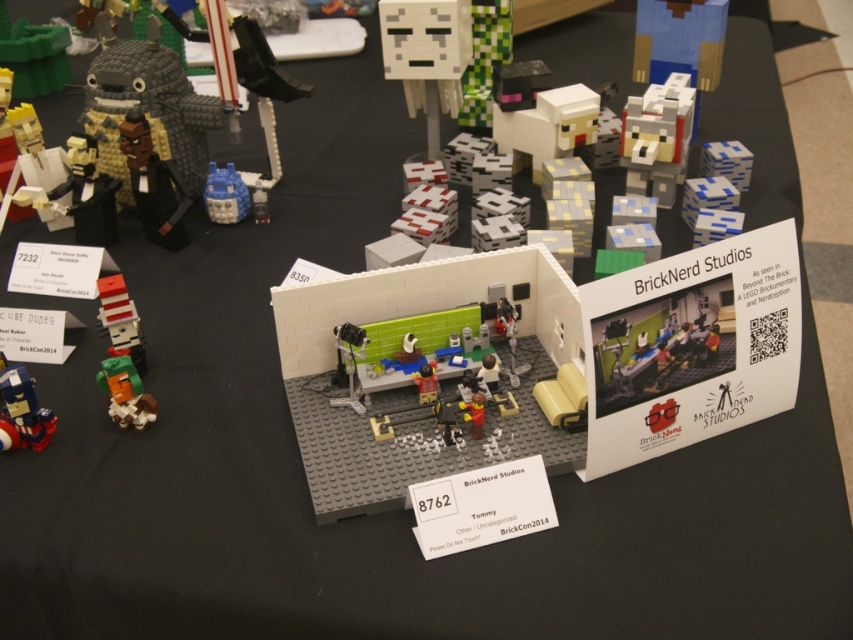
You are a LEGO enthusiast trying to build a tower using the shiny blue plastic robot at lower left and the matte red brick at left. Which object should you place at the bottom to ensure stability?

The matte red brick at left should be placed at the bottom because it is taller than the shiny blue plastic robot at lower left, providing a more stable base.

Based on the photo, you are a LEGO designer trying to fit a green matte creeper at lower left and a translucent blue plastic at center into a narrow space. Which object can fit through the space more easily?

The green matte creeper at lower left can fit through the narrow space more easily because it is thinner than the translucent blue plastic at center.

You are at the LEGO display at BrickCon2014 and want to locate the shiny blue plastic robot at lower left. According to the map coordinates provided, where exactly should you look?

You should look at point (x=21, y=410) to find the shiny blue plastic robot at lower left.